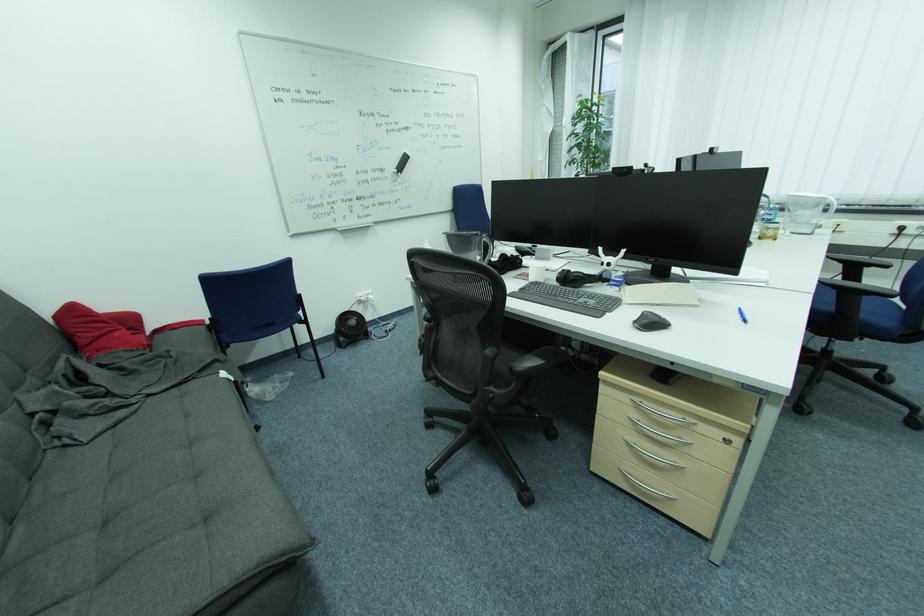
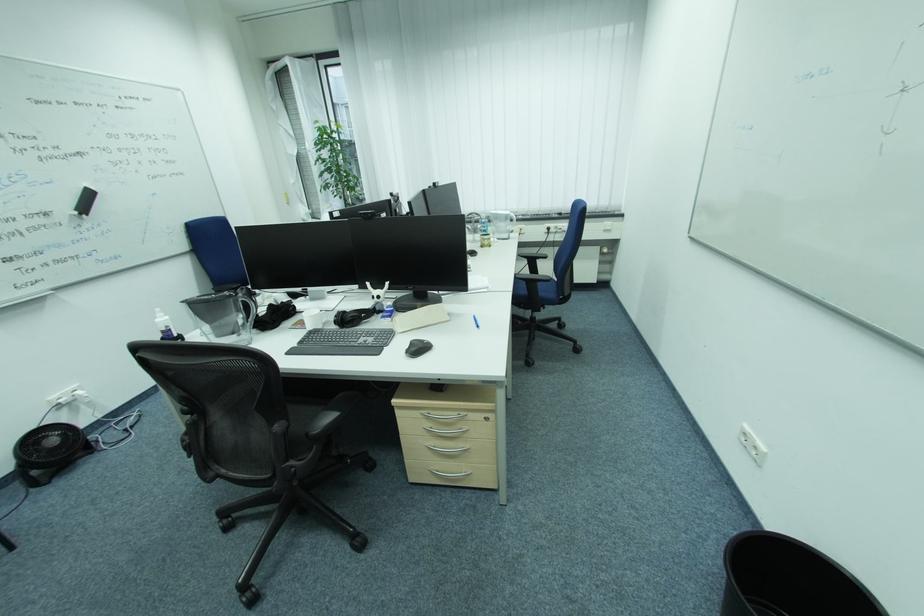
Find the pixel in the second image that matches the point at 608,276 in the first image.

(381, 309)